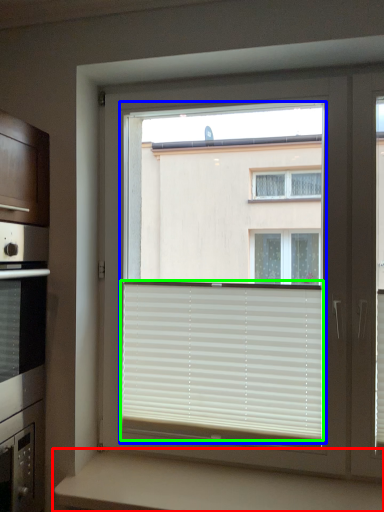
Question: Considering the real-world distances, which object is closest to counter (highlighted by a red box)? bay window (highlighted by a blue box) or window blind (highlighted by a green box).

Choices:
 (A) bay window
 (B) window blind

Answer: (B)